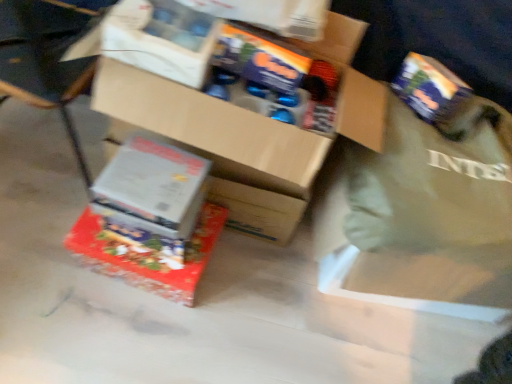
Question: Are wooden chair at lower left and white cardboard box at lower left, placed as the 2th box when sorted from bottom to top, far apart?

Choices:
 (A) no
 (B) yes

Answer: (A)

Question: Is wooden chair at lower left taller than white cardboard box at lower left, placed as the 2th box when sorted from bottom to top?

Choices:
 (A) yes
 (B) no

Answer: (A)

Question: Does wooden chair at lower left have a smaller size compared to white cardboard box at lower left, placed as the 2th box when sorted from bottom to top?

Choices:
 (A) yes
 (B) no

Answer: (B)

Question: Does wooden chair at lower left have a larger size compared to white cardboard box at lower left, marked as the 2th box in a top-to-bottom arrangement?

Choices:
 (A) no
 (B) yes

Answer: (B)

Question: Is wooden chair at lower left facing towards white cardboard box at lower left, placed as the 2th box when sorted from bottom to top?

Choices:
 (A) no
 (B) yes

Answer: (A)

Question: Is cardboard box at center, the first box positioned from the top, inside the boundaries of shiny metallic box at center, placed as the 3th box when sorted from top to bottom, or outside?

Choices:
 (A) outside
 (B) inside

Answer: (A)

Question: From a real-world perspective, is cardboard box at center, marked as the 3th box in a bottom-to-top arrangement, positioned above or below shiny metallic box at center, positioned as the first box in bottom-to-top order?

Choices:
 (A) above
 (B) below

Answer: (A)

Question: Is cardboard box at center, the first box positioned from the top, wider or thinner than shiny metallic box at center, positioned as the first box in bottom-to-top order?

Choices:
 (A) thin
 (B) wide

Answer: (B)

Question: From the image's perspective, is cardboard box at center, the first box positioned from the top, located above or below shiny metallic box at center, placed as the 3th box when sorted from top to bottom?

Choices:
 (A) above
 (B) below

Answer: (A)

Question: From a real-world perspective, is wooden chair at lower left physically located above or below green fabric tote bag at right?

Choices:
 (A) below
 (B) above

Answer: (A)

Question: Considering the relative positions of wooden chair at lower left and green fabric tote bag at right in the image provided, is wooden chair at lower left to the left or to the right of green fabric tote bag at right?

Choices:
 (A) right
 (B) left

Answer: (B)

Question: In terms of size, does wooden chair at lower left appear bigger or smaller than green fabric tote bag at right?

Choices:
 (A) big
 (B) small

Answer: (A)

Question: Would you say wooden chair at lower left is inside or outside green fabric tote bag at right?

Choices:
 (A) inside
 (B) outside

Answer: (B)

Question: Is cardboard box at center, the first box positioned from the top, situated inside wooden chair at lower left or outside?

Choices:
 (A) outside
 (B) inside

Answer: (A)

Question: In terms of size, does cardboard box at center, the first box positioned from the top, appear bigger or smaller than wooden chair at lower left?

Choices:
 (A) big
 (B) small

Answer: (B)